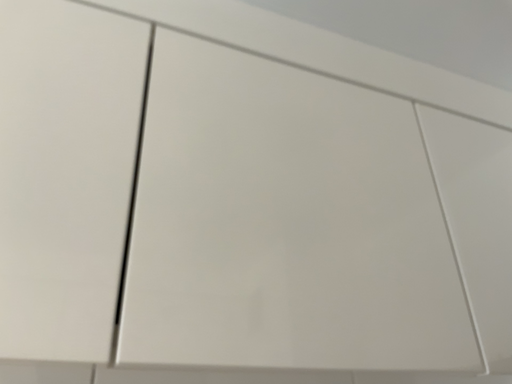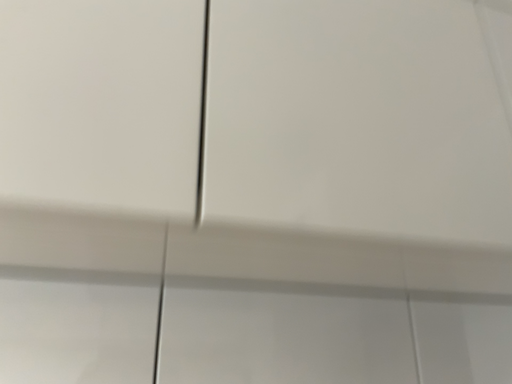
Question: Which way did the camera rotate in the video?

Choices:
 (A) rotated downward
 (B) rotated upward

Answer: (A)